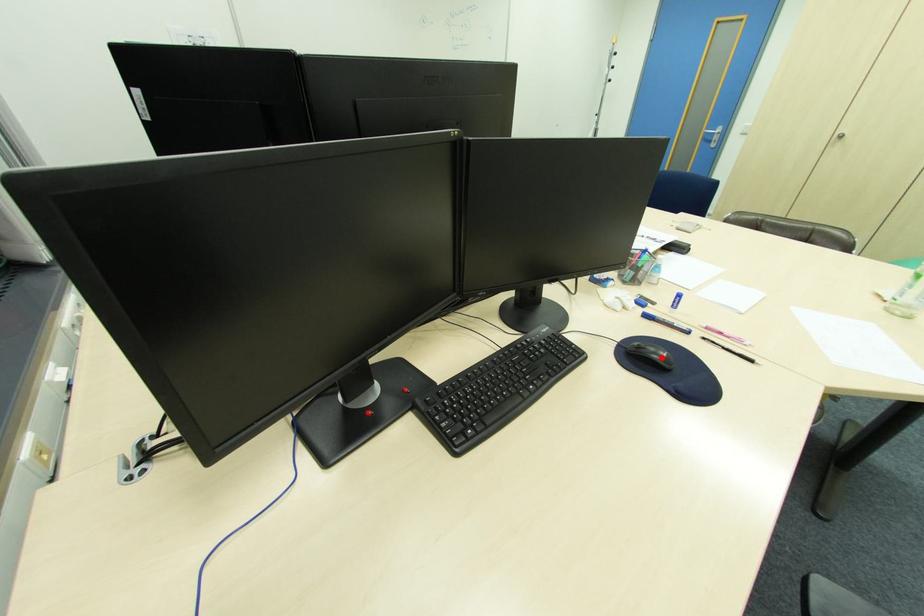
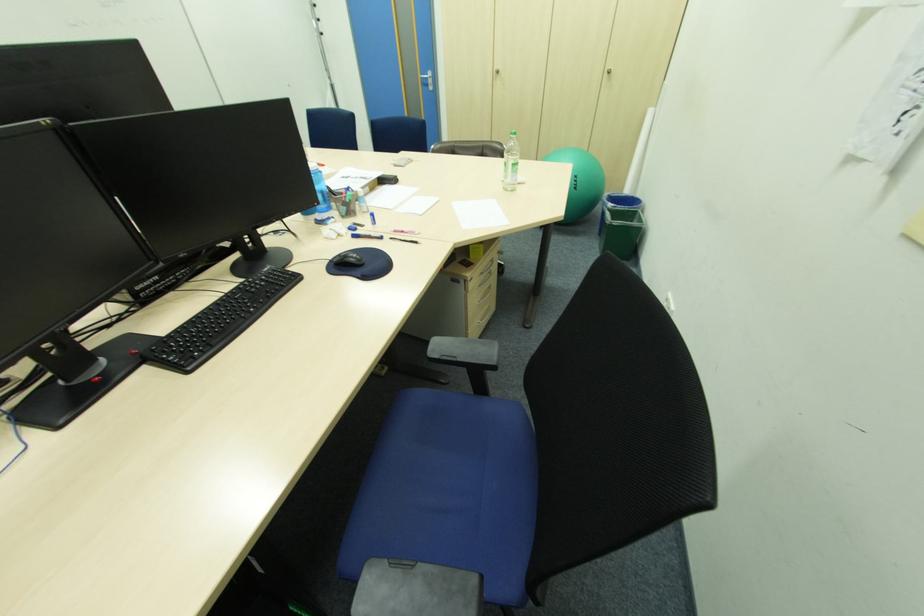
Locate, in the second image, the point that corresponds to the highlighted location in the first image.

(357, 260)